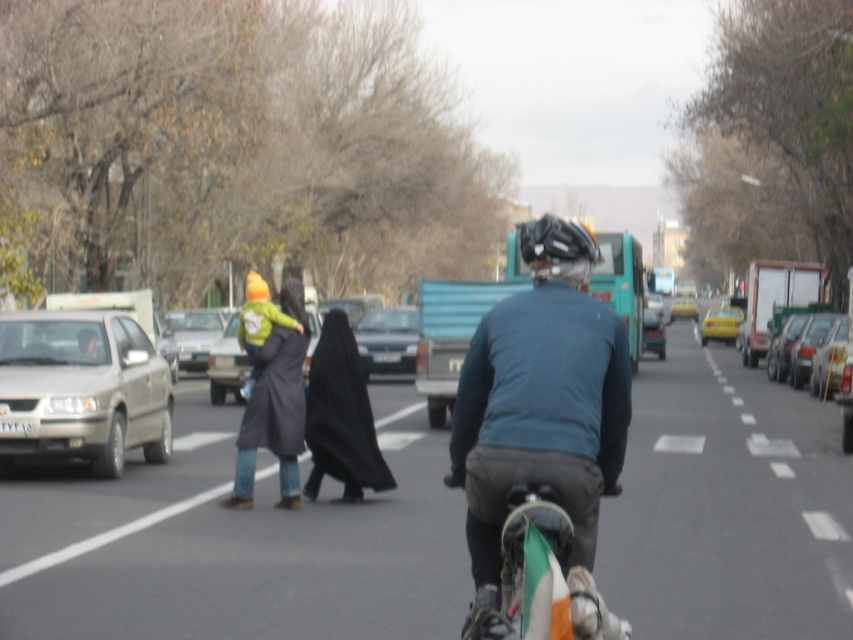
You are a pedestrian standing at the edge of the street. You see a black fabric at center and a matte gray car at center. Which object is closer to you?

The black fabric at center is closer to you because it is 66.33 feet away from the matte gray car at center, but since both are at the center, the distance between them suggests the fabric is in front of the car.

You are a pedestrian standing at the edge of the street. You see a dark blue coat at center and a black fabric at center. Which one is closer to you?

The dark blue coat at center is smaller than the black fabric at center, so it is farther away from you.